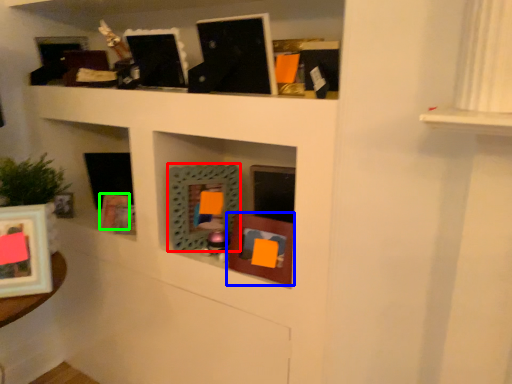
Question: Considering the real-world distances, which object is closest to picture frame (highlighted by a red box)? picture frame (highlighted by a blue box) or picture frame (highlighted by a green box).

Choices:
 (A) picture frame
 (B) picture frame

Answer: (A)